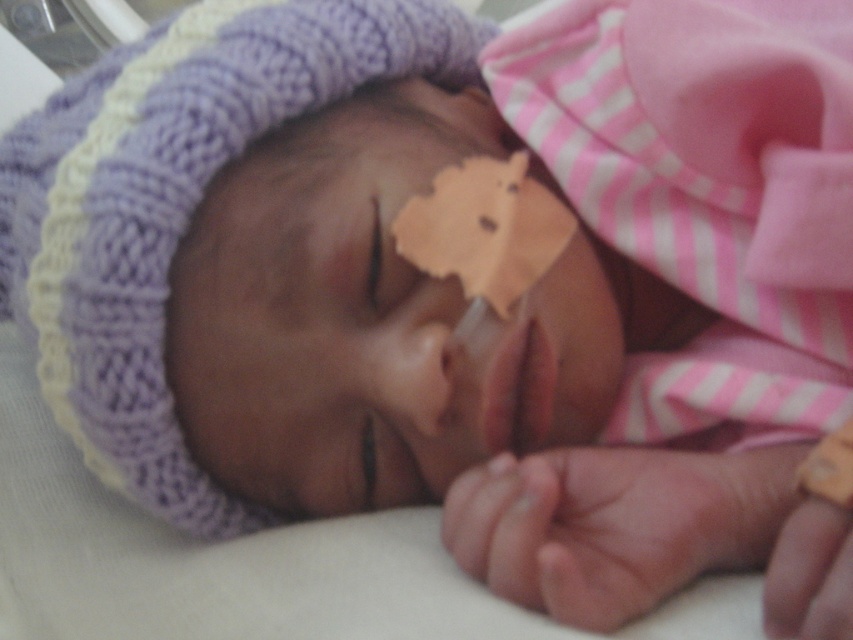
Can you confirm if pink smooth skin at lower right is taller than smooth skin nose at center?

Yes, pink smooth skin at lower right is taller than smooth skin nose at center.

Does point (514, 476) come behind point (384, 339)?

That is False.

Is point (524, 600) more distant than point (444, 400)?

No.

This screenshot has height=640, width=853. I want to click on pink smooth skin at lower right, so click(614, 524).